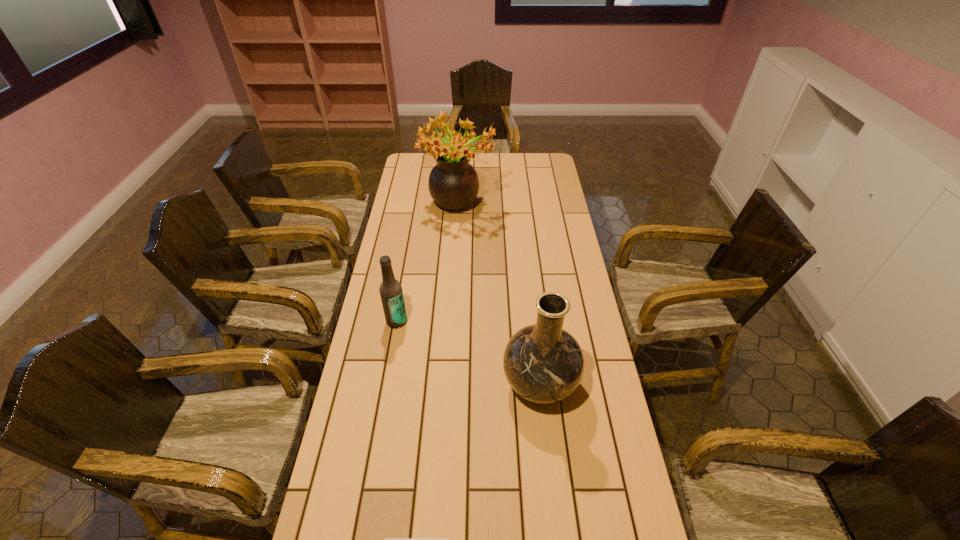
Identify which object is located as the second nearest to the second nearest object. Please provide its 2D coordinates. Your answer should be formatted as a tuple, i.e. [(x, y)], where the tuple contains the x and y coordinates of a point satisfying the conditions above.

[(385, 539)]

Where is `free region that satisfies the following two spatial constraints: 1. on the side of the third nearest object with the label; 2. on the right side of the rightmost object`? free region that satisfies the following two spatial constraints: 1. on the side of the third nearest object with the label; 2. on the right side of the rightmost object is located at coordinates (386, 384).

Find the location of a particular element. The image size is (960, 540). free region that satisfies the following two spatial constraints: 1. on the side of the vase with the label; 2. on the right side of the beer bottle is located at coordinates (386, 384).